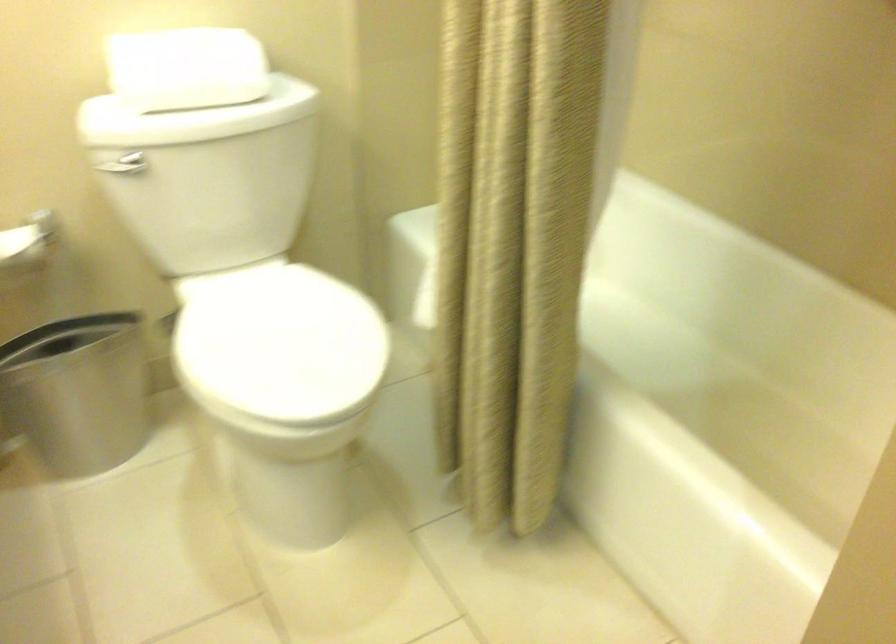
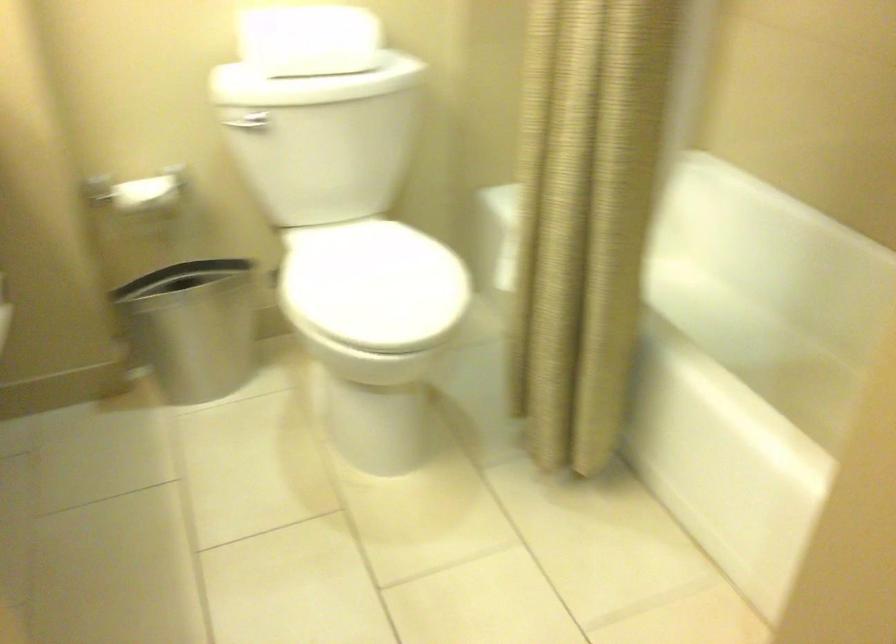
Locate, in the second image, the point that corresponds to the point at 125,165 in the first image.

(247, 122)